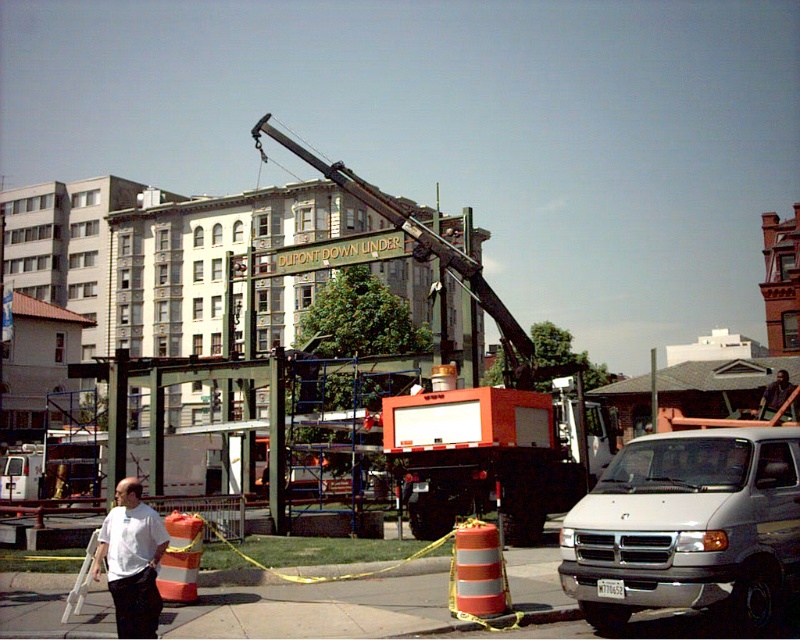
Does white shirt at center lie in front of dark brown leather jacket at center?

That is True.

Does white shirt at center have a lesser width compared to dark brown leather jacket at center?

Correct, white shirt at center's width is less than dark brown leather jacket at center's.

The image size is (800, 640). I want to click on white shirt at center, so click(x=132, y=561).

Who is positioned more to the left, white matte van at center or dark brown leather jacket at center?

white matte van at center

Is white matte van at center to the left of dark brown leather jacket at center from the viewer's perspective?

Correct, you'll find white matte van at center to the left of dark brown leather jacket at center.

Where is `white matte van at center`? white matte van at center is located at coordinates (688, 529).

I want to click on white matte van at center, so click(688, 529).

Who is more forward, [428,492] or [120,570]?

Point [120,570] is more forward.

What do you see at coordinates (494, 456) in the screenshot?
I see `orange matte truck at center` at bounding box center [494, 456].

Identify the location of orange matte truck at center. The image size is (800, 640). (494, 456).